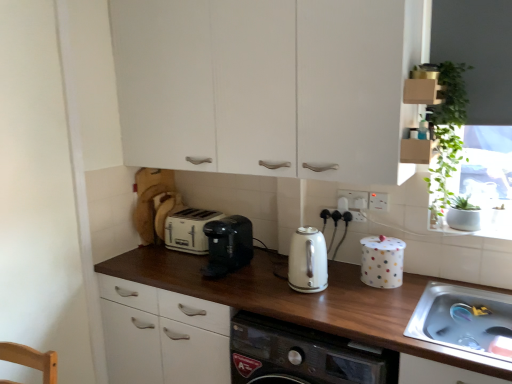
This screenshot has height=384, width=512. Describe the element at coordinates (189, 230) in the screenshot. I see `white plastic toaster at center` at that location.

Measure the distance between point (179, 246) and camera.

Point (179, 246) and camera are 2.23 meters apart from each other.

What is the approximate width of brown wood countertop at center?

The width of brown wood countertop at center is 61.40 centimeters.

Measure the distance between green leafy plant at upper right and camera.

green leafy plant at upper right and camera are 1.62 meters apart from each other.

How much space does white plastic socket at upper center, positioned as the 1th electric outlet in left-to-right order, occupy horizontally?

0.55 inches.

The width and height of the screenshot is (512, 384). What do you see at coordinates (267, 84) in the screenshot?
I see `white matte cabinet at upper center` at bounding box center [267, 84].

Identify the location of black plastic coffee maker at center, the 1th kitchen appliance viewed from the left. (228, 245).

What do you see at coordinates (461, 318) in the screenshot? I see `stainless steel sink at lower right` at bounding box center [461, 318].

Identify the location of white plastic toaster at center. The height and width of the screenshot is (384, 512). (189, 230).

This screenshot has width=512, height=384. What are the coordinates of `plant above the white glossy kettle at center, positioned as the 1th kitchen appliance in right-to-left order (from a real-world perspective)` in the screenshot? It's located at (447, 132).

Would you consider white glossy kettle at center, positioned as the 1th kitchen appliance in right-to-left order, to be distant from green leafy plant at upper right?

white glossy kettle at center, positioned as the 1th kitchen appliance in right-to-left order, is actually quite close to green leafy plant at upper right.

Consider the image. Could you tell me if white glossy kettle at center, arranged as the 2th kitchen appliance when viewed from the left, is turned towards green leafy plant at upper right?

No.

From the image's perspective, which object appears higher, white glossy kettle at center, arranged as the 2th kitchen appliance when viewed from the left, or green leafy plant at upper right?

From the image's view, green leafy plant at upper right is above.

Identify the location of toaster on the left of brown wood countertop at center. (189, 230).

Does white plastic toaster at center contain brown wood countertop at center?

No, brown wood countertop at center is not a part of white plastic toaster at center.

Consider the image. Is white plastic toaster at center wider than brown wood countertop at center?

Incorrect, the width of white plastic toaster at center does not surpass that of brown wood countertop at center.

Are white plastic toaster at center and brown wood countertop at center making contact?

white plastic toaster at center and brown wood countertop at center are not in contact.

Is stainless steel sink at lower right next to brown wood countertop at center and touching it?

stainless steel sink at lower right and brown wood countertop at center are not in contact.

Considering the positions of points (454, 302) and (423, 344), is point (454, 302) closer to camera compared to point (423, 344)?

No, it is behind (423, 344).

Consider the image. From a real-world perspective, is stainless steel sink at lower right on top of brown wood countertop at center?

Yes.

Considering the sizes of stainless steel sink at lower right and brown wood countertop at center in the image, is stainless steel sink at lower right taller or shorter than brown wood countertop at center?

Clearly, stainless steel sink at lower right is shorter compared to brown wood countertop at center.

From a real-world perspective, who is located lower, green leafy plant at upper right or brown wood countertop at center?

brown wood countertop at center.

Measure the distance between green leafy plant at upper right and brown wood countertop at center.

green leafy plant at upper right and brown wood countertop at center are 27.10 inches apart.

You are a GUI agent. You are given a task and a screenshot of the screen. Output one action in this format:
    pyautogui.click(x=<x>, y=<y>)
    Task: Click on the countertop that is in front of the green leafy plant at upper right
    This screenshot has height=384, width=512.
    Given the screenshot: What is the action you would take?
    pyautogui.click(x=303, y=300)

Is green leafy plant at upper right taller than brown wood countertop at center?

No, green leafy plant at upper right is not taller than brown wood countertop at center.

Between white plastic socket at upper center, positioned as the 1th electric outlet in left-to-right order, and white polka dot canister at right, which one has smaller size?

Smaller between the two is white plastic socket at upper center, positioned as the 1th electric outlet in left-to-right order.

Would you say white plastic socket at upper center, the 2th electric outlet in the right-to-left sequence, contains white polka dot canister at right?

That's incorrect, white polka dot canister at right is not inside white plastic socket at upper center, the 2th electric outlet in the right-to-left sequence.

Which object is closer to the camera taking this photo, white plastic socket at upper center, positioned as the 1th electric outlet in left-to-right order, or white polka dot canister at right?

white polka dot canister at right is in front.

In terms of width, does stainless steel sink at lower right look wider or thinner when compared to white glossy kettle at center, positioned as the 1th kitchen appliance in right-to-left order?

stainless steel sink at lower right is wider than white glossy kettle at center, positioned as the 1th kitchen appliance in right-to-left order.

How many degrees apart are the facing directions of stainless steel sink at lower right and white glossy kettle at center, arranged as the 2th kitchen appliance when viewed from the left?

The facing directions of stainless steel sink at lower right and white glossy kettle at center, arranged as the 2th kitchen appliance when viewed from the left, are 1.66e-05 degrees apart.

Which object is positioned more to the right, stainless steel sink at lower right or white glossy kettle at center, arranged as the 2th kitchen appliance when viewed from the left?

stainless steel sink at lower right is more to the right.

Would you consider stainless steel sink at lower right to be distant from white glossy kettle at center, positioned as the 1th kitchen appliance in right-to-left order?

stainless steel sink at lower right is near white glossy kettle at center, positioned as the 1th kitchen appliance in right-to-left order, not far away.

Can you confirm if white polka dot canister at right is smaller than white plastic toaster at center?

Correct, white polka dot canister at right occupies less space than white plastic toaster at center.

Can you confirm if white polka dot canister at right is taller than white plastic toaster at center?

Yes.

Based on the photo, is white polka dot canister at right in front of white plastic toaster at center?

Yes, it is in front of white plastic toaster at center.

Can you confirm if white polka dot canister at right is positioned to the right of white plastic toaster at center?

Yes, white polka dot canister at right is to the right of white plastic toaster at center.

I want to click on the 1st kitchen appliance counting from the left side of the green leafy plant at upper right, so click(307, 261).

Locate an element on the screen. The width and height of the screenshot is (512, 384). countertop that is on the right side of white plastic toaster at center is located at coordinates point(303,300).

Based on their spatial positions, is white matte cabinet at upper center or brown wood countertop at center closer to green leafy plant at upper right?

white matte cabinet at upper center.

Estimate the real-world distances between objects in this image. Which object is further from stainless steel sink at lower right, white plastic electrical outlet at upper center, the first electric outlet from the right, or black plastic coffee maker at center, the 1th kitchen appliance viewed from the left?

Based on the image, black plastic coffee maker at center, the 1th kitchen appliance viewed from the left, appears to be further to stainless steel sink at lower right.

When comparing their distances from white glossy kettle at center, arranged as the 2th kitchen appliance when viewed from the left, does stainless steel sink at lower right or white matte cabinet at upper center seem closer?

stainless steel sink at lower right.

Looking at the image, which one is located further to brown wood countertop at center, white matte cabinet at upper center or green leafy plant at upper right?

white matte cabinet at upper center is positioned further to the anchor brown wood countertop at center.

Which object lies nearer to the anchor point white plastic electrical outlet at upper center, which is counted as the second electric outlet, starting from the left, white plastic toaster at center or black plastic coffee maker at center, the 2th kitchen appliance when ordered from right to left?

black plastic coffee maker at center, the 2th kitchen appliance when ordered from right to left.

When comparing their distances from white polka dot canister at right, does stainless steel sink at lower right or white glossy kettle at center, arranged as the 2th kitchen appliance when viewed from the left, seem closer?

Among the two, white glossy kettle at center, arranged as the 2th kitchen appliance when viewed from the left, is located nearer to white polka dot canister at right.

Estimate the real-world distances between objects in this image. Which object is closer to black plastic coffee maker at center, the 1th kitchen appliance viewed from the left, white plastic electrical outlet at upper center, which is counted as the second electric outlet, starting from the left, or green leafy plant at upper right?

Among the two, white plastic electrical outlet at upper center, which is counted as the second electric outlet, starting from the left, is located nearer to black plastic coffee maker at center, the 1th kitchen appliance viewed from the left.

Considering their positions, is white matte cabinet at upper center positioned further to white polka dot canister at right than black plastic coffee maker at center, the 1th kitchen appliance viewed from the left?

The object further to white polka dot canister at right is white matte cabinet at upper center.

Where is `appliance located between brown wood countertop at center and white plastic toaster at center in the depth direction`? appliance located between brown wood countertop at center and white plastic toaster at center in the depth direction is located at coordinates (382, 261).

Where is `electric outlet between white plastic socket at upper center, the 2th electric outlet in the right-to-left sequence, and white polka dot canister at right from top to bottom`? Image resolution: width=512 pixels, height=384 pixels. electric outlet between white plastic socket at upper center, the 2th electric outlet in the right-to-left sequence, and white polka dot canister at right from top to bottom is located at coordinates (378, 201).

Where is `appliance between green leafy plant at upper right and stainless steel sink at lower right in the up-down direction`? appliance between green leafy plant at upper right and stainless steel sink at lower right in the up-down direction is located at coordinates (382, 261).

Find the location of a particular element. The image size is (512, 384). sink between white matte cabinet at upper center and brown wood countertop at center from top to bottom is located at coordinates (461, 318).